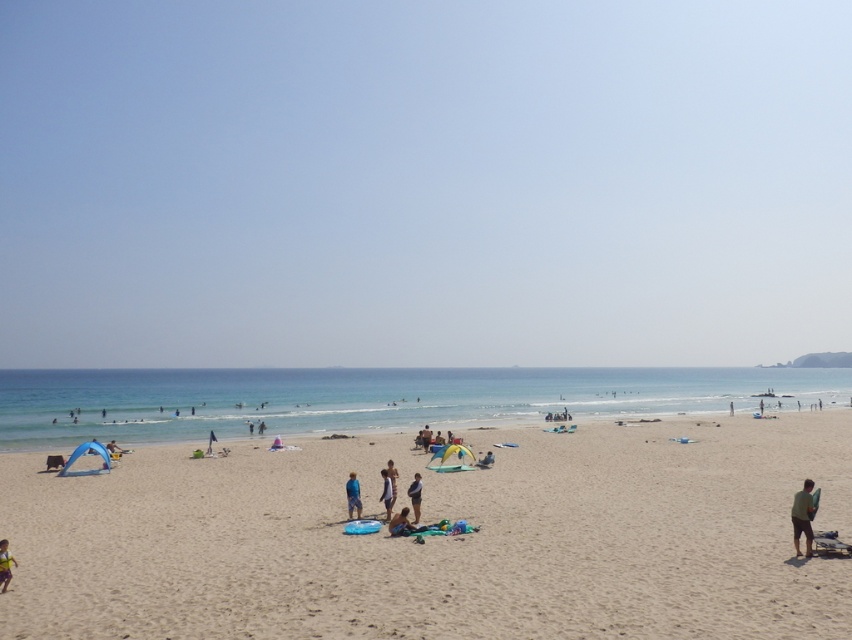
Is point (821, 284) positioned in front of point (403, 528)?

No, (821, 284) is further to viewer.

Between transparent blue sky at upper center and light brown fabric bag at center, which one is positioned lower?

light brown fabric bag at center is lower down.

Is point (697, 67) farther from viewer compared to point (409, 525)?

That is True.

Find the location of a particular element. transparent blue sky at upper center is located at coordinates (423, 182).

Which is in front, point (619, 570) or point (423, 442)?

Positioned in front is point (619, 570).

Who is more distant from viewer, (x=551, y=621) or (x=422, y=436)?

The point (x=422, y=436) is behind.

You are a GUI agent. You are given a task and a screenshot of the screen. Output one action in this format:
    pyautogui.click(x=<x>, y=<y>)
    Task: Click on the fine-grained sand at center
    
    Given the screenshot: What is the action you would take?
    click(x=441, y=538)

Does transparent blue sky at upper center appear on the left side of fine-grained sand at center?

Correct, you'll find transparent blue sky at upper center to the left of fine-grained sand at center.

Consider the image. Who is shorter, transparent blue sky at upper center or fine-grained sand at center?

With less height is fine-grained sand at center.

Looking at this image, who is more forward, (482, 17) or (496, 632)?

Point (496, 632) is in front.

Locate an element on the screen. transparent blue sky at upper center is located at coordinates (423, 182).